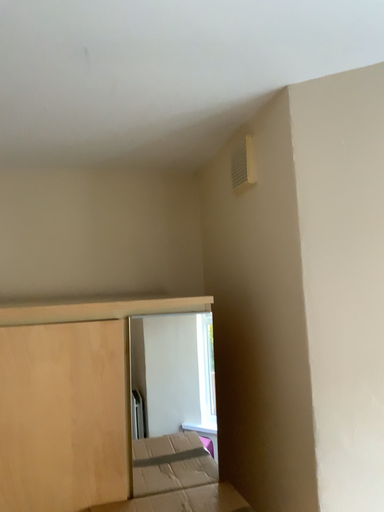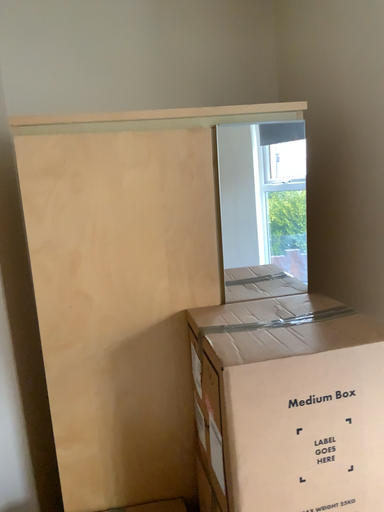
Question: How did the camera likely rotate when shooting the video?

Choices:
 (A) rotated upward
 (B) rotated downward

Answer: (B)